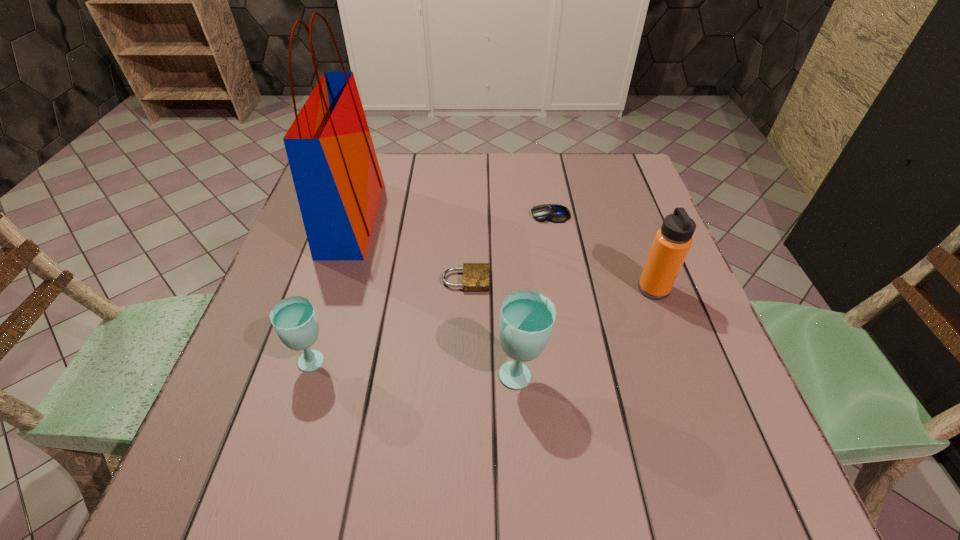
Identify the location of vacant point that satisfies the following two spatial constraints: 1. on the back side of the taller glass; 2. on the left side of the rightmost object. Image resolution: width=960 pixels, height=540 pixels. (515, 289).

The height and width of the screenshot is (540, 960). I want to click on free location that satisfies the following two spatial constraints: 1. on the keyhole side of the taller glass; 2. on the right side of the third object from left to right, so click(463, 374).

The image size is (960, 540). What are the coordinates of `free region that satisfies the following two spatial constraints: 1. on the handle side of the shorter glass; 2. on the right side of the tallest object` in the screenshot? It's located at (306, 362).

This screenshot has height=540, width=960. What are the coordinates of `free spot that satisfies the following two spatial constraints: 1. on the back side of the rightmost object; 2. on the button side of the computer mouse` in the screenshot? It's located at (626, 215).

Locate an element on the screen. This screenshot has height=540, width=960. vacant space that satisfies the following two spatial constraints: 1. on the button side of the thermos bottle; 2. on the right side of the fifth tallest object is located at coordinates (564, 289).

I want to click on free space that satisfies the following two spatial constraints: 1. on the back side of the rightmost object; 2. on the button side of the fifth tallest object, so click(626, 215).

What are the coordinates of `vacant space that satisfies the following two spatial constraints: 1. on the back side of the shorter glass; 2. on the handle side of the tallest object` in the screenshot? It's located at (358, 219).